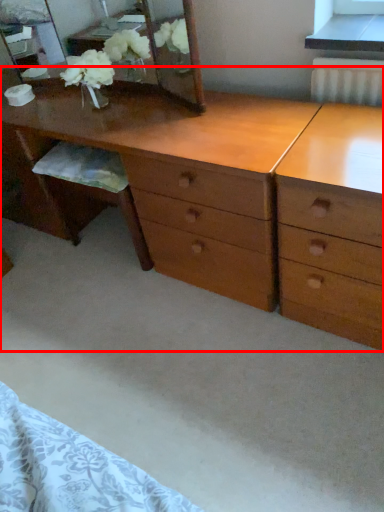
Question: Observing the image, what is the correct spatial positioning of desk (annotated by the red box) in reference to mirror?

Choices:
 (A) right
 (B) left

Answer: (A)